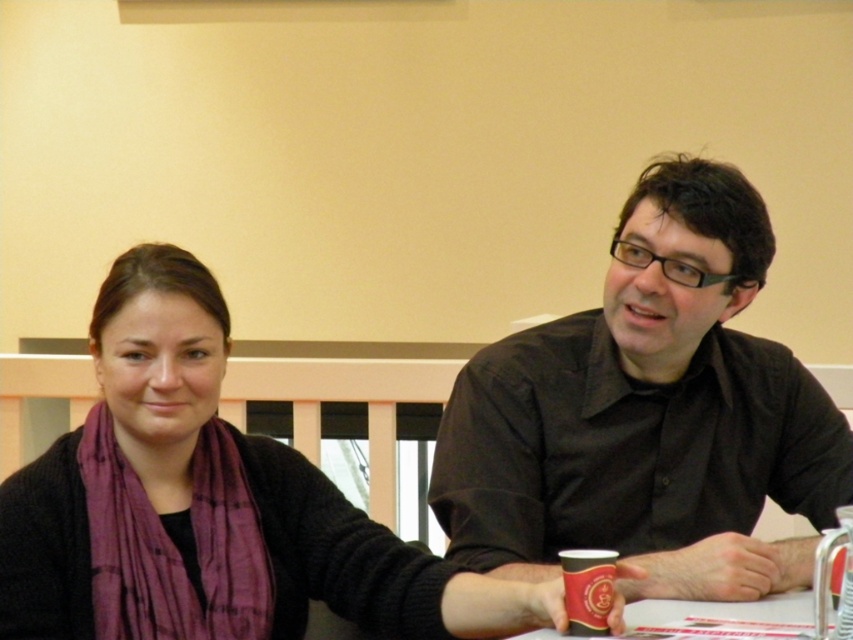
Question: Estimate the real-world distances between objects in this image. Which object is closer to the purple scarf at center?

Choices:
 (A) black matte cup at lower center
 (B) matte black shirt at center

Answer: (B)

Question: Which point is farther to the camera?

Choices:
 (A) black matte cup at lower center
 (B) matte black shirt at center

Answer: (B)

Question: Can you confirm if purple scarf at center is positioned below black matte cup at lower center?

Choices:
 (A) yes
 (B) no

Answer: (B)

Question: Does matte black shirt at center have a lesser width compared to black matte cup at lower center?

Choices:
 (A) yes
 (B) no

Answer: (B)

Question: Which of the following is the farthest from the observer?

Choices:
 (A) matte black shirt at center
 (B) black matte cup at lower center
 (C) purple scarf at center

Answer: (A)

Question: Can you confirm if matte black shirt at center is bigger than black matte cup at lower center?

Choices:
 (A) yes
 (B) no

Answer: (A)